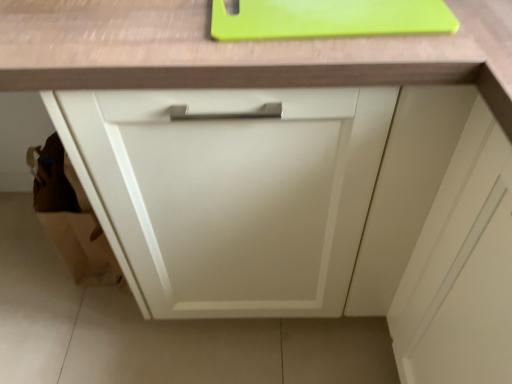
What do you see at coordinates (327, 18) in the screenshot? Image resolution: width=512 pixels, height=384 pixels. I see `green plastic cutting board at upper center` at bounding box center [327, 18].

Identify the location of green plastic cutting board at upper center. (327, 18).

What do you see at coordinates (231, 194) in the screenshot? I see `matte white cabinet at center` at bounding box center [231, 194].

The width and height of the screenshot is (512, 384). Find the location of `matte white cabinet at center`. matte white cabinet at center is located at coordinates (231, 194).

Identify the location of green plastic cutting board at upper center. (327, 18).

Between green plastic cutting board at upper center and matte white cabinet at center, which one appears on the left side from the viewer's perspective?

From the viewer's perspective, matte white cabinet at center appears more on the left side.

Which is in front, green plastic cutting board at upper center or matte white cabinet at center?

matte white cabinet at center is closer to the camera.

Considering the points (242, 14) and (120, 228), which point is behind, point (242, 14) or point (120, 228)?

Positioned behind is point (120, 228).

From the image's perspective, is green plastic cutting board at upper center beneath matte white cabinet at center?

No, from the image's perspective, green plastic cutting board at upper center is not beneath matte white cabinet at center.

From a real-world perspective, is green plastic cutting board at upper center on matte white cabinet at center?

Yes, from a real-world perspective, green plastic cutting board at upper center is above matte white cabinet at center.

Which object is wider, green plastic cutting board at upper center or matte white cabinet at center?

With larger width is matte white cabinet at center.

Considering the sizes of objects green plastic cutting board at upper center and matte white cabinet at center in the image provided, who is shorter, green plastic cutting board at upper center or matte white cabinet at center?

green plastic cutting board at upper center is shorter.

Can you confirm if green plastic cutting board at upper center is smaller than matte white cabinet at center?

Indeed, green plastic cutting board at upper center has a smaller size compared to matte white cabinet at center.

Would you say green plastic cutting board at upper center contains matte white cabinet at center?

No, matte white cabinet at center is not surrounded by green plastic cutting board at upper center.

Is green plastic cutting board at upper center beside matte white cabinet at center?

They are not placed beside each other.

Does green plastic cutting board at upper center turn towards matte white cabinet at center?

Yes, green plastic cutting board at upper center faces towards matte white cabinet at center.

Identify the location of cabinetry in front of the green plastic cutting board at upper center. This screenshot has width=512, height=384. (231, 194).

Does matte white cabinet at center appear on the left side of green plastic cutting board at upper center?

Yes.

Is matte white cabinet at center in front of or behind green plastic cutting board at upper center in the image?

In the image, matte white cabinet at center appears in front of green plastic cutting board at upper center.

Does point (352, 232) come closer to viewer compared to point (444, 24)?

No, it is not.

From the image's perspective, is matte white cabinet at center on top of green plastic cutting board at upper center?

No, from the image's perspective, matte white cabinet at center is not on top of green plastic cutting board at upper center.

From a real-world perspective, is matte white cabinet at center above or below green plastic cutting board at upper center?

matte white cabinet at center is situated lower than green plastic cutting board at upper center in the real world.

In terms of width, does matte white cabinet at center look wider or thinner when compared to green plastic cutting board at upper center?

In the image, matte white cabinet at center appears to be wider than green plastic cutting board at upper center.

Which of these two, matte white cabinet at center or green plastic cutting board at upper center, stands shorter?

green plastic cutting board at upper center.

Can you confirm if matte white cabinet at center is bigger than green plastic cutting board at upper center?

Correct, matte white cabinet at center is larger in size than green plastic cutting board at upper center.

Can we say matte white cabinet at center lies outside green plastic cutting board at upper center?

Absolutely, matte white cabinet at center is external to green plastic cutting board at upper center.

Is matte white cabinet at center directly adjacent to green plastic cutting board at upper center?

matte white cabinet at center and green plastic cutting board at upper center are clearly separated.

Is matte white cabinet at center aimed at green plastic cutting board at upper center?

No, matte white cabinet at center is not turned towards green plastic cutting board at upper center.

Can you tell me how much matte white cabinet at center and green plastic cutting board at upper center differ in facing direction?

The angular difference between matte white cabinet at center and green plastic cutting board at upper center is 1.08 degrees.

The height and width of the screenshot is (384, 512). What are the coordinates of `cutting board above the matte white cabinet at center (from the image's perspective)` in the screenshot? It's located at (327, 18).

Identify the location of cutting board that appears above the matte white cabinet at center (from a real-world perspective). This screenshot has width=512, height=384. (327, 18).

The width and height of the screenshot is (512, 384). In order to click on cabinetry on the left of the green plastic cutting board at upper center in this screenshot , I will do `click(231, 194)`.